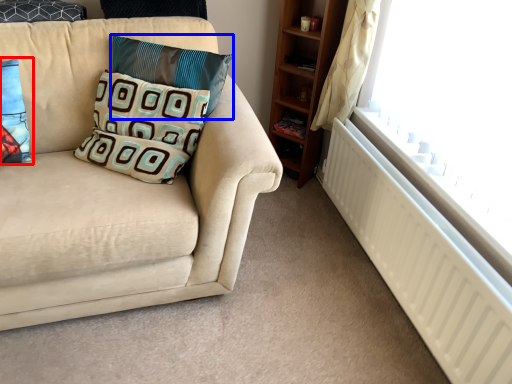
Question: Which object appears closest to the camera in this image, pillow (highlighted by a red box) or pillow (highlighted by a blue box)?

Choices:
 (A) pillow
 (B) pillow

Answer: (A)